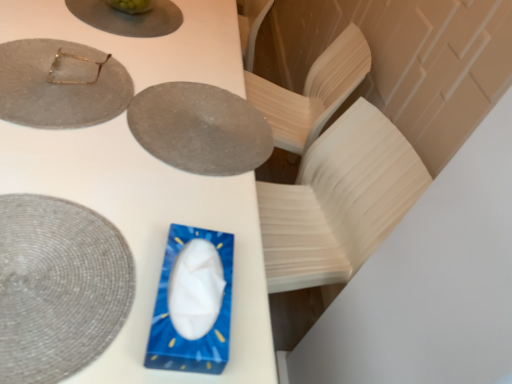
At what (x,y) coordinates should I click in order to perform the action: click on free space between matte gray placemat at upper left, which appears as the third plate when ordered from the bottom, and matte gray plate at upper center, positioned as the 1th plate in top-to-bottom order. Please return your answer as a coordinate pair (x, y). This screenshot has width=512, height=384. Looking at the image, I should click on (100, 43).